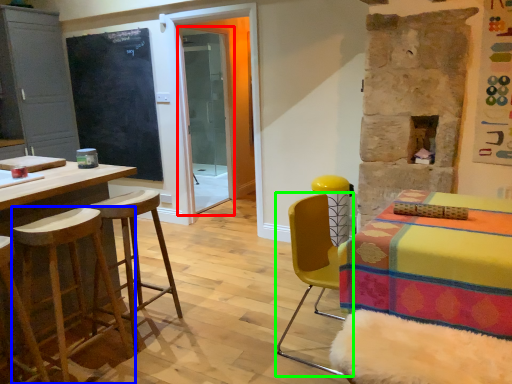
Question: Which object is the closest to the screen door (highlighted by a red box)? Choose among these: stool (highlighted by a blue box) or chair (highlighted by a green box).

Choices:
 (A) stool
 (B) chair

Answer: (B)